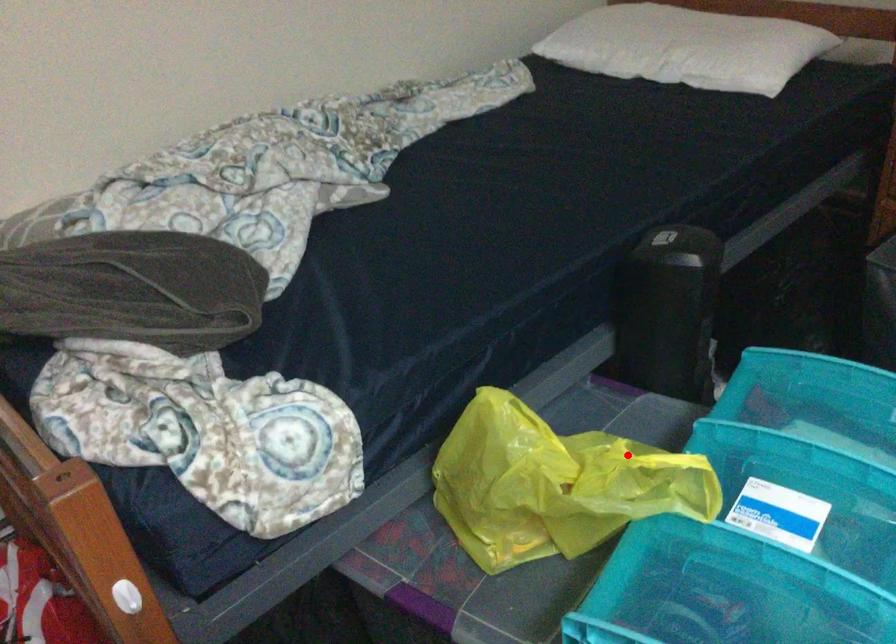
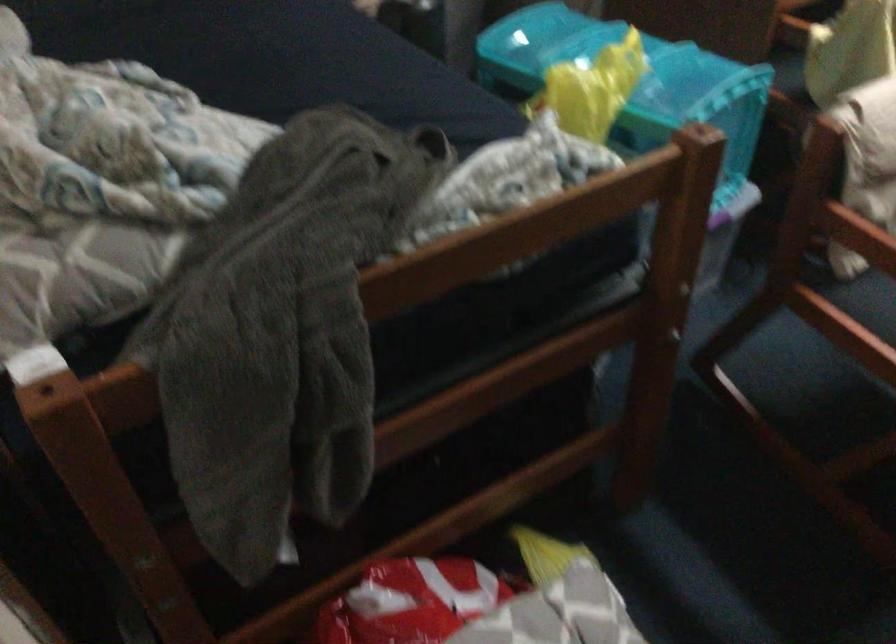
Where in the second image is the point corresponding to the highlighted location from the first image?

(600, 62)